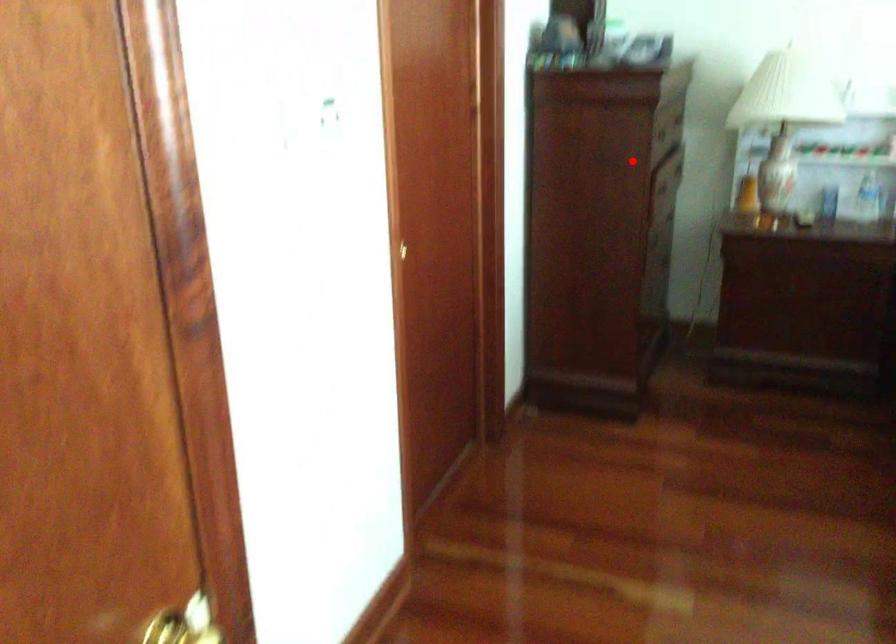
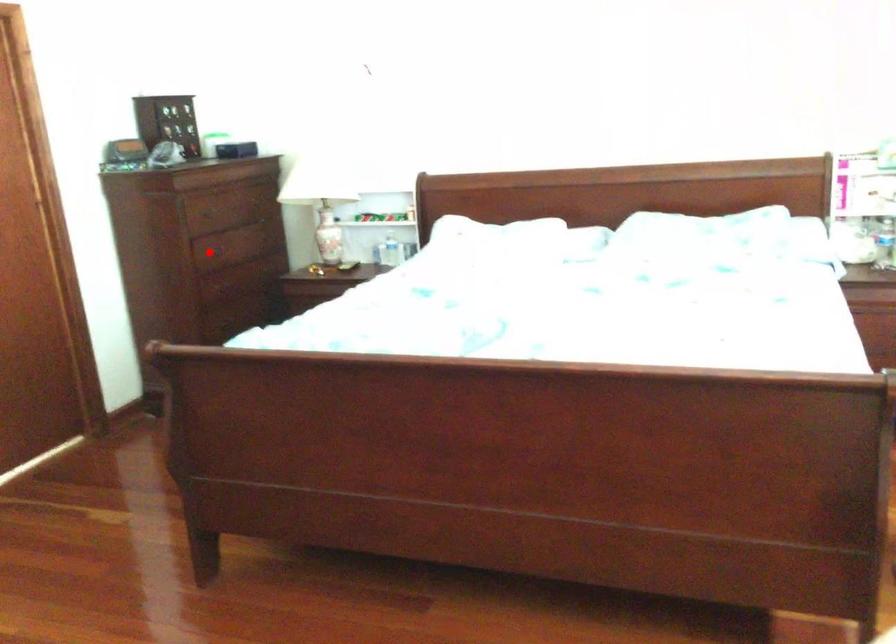
I am providing you with two images of the same scene from different viewpoints. A red point is marked on the first image and another point is marked on the second image. Are the points marked in image1 and image2 representing the same 3D position?

Yes